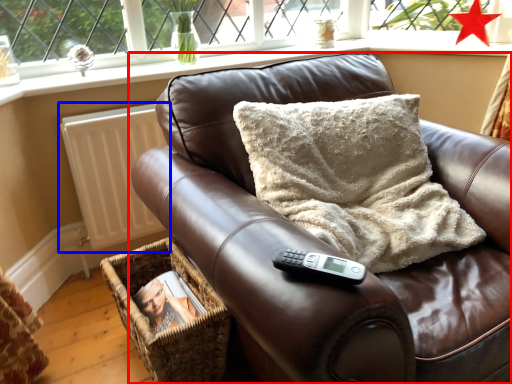
Question: Among these objects, which one is nearest to the camera, furniture (highlighted by a red box) or radiator (highlighted by a blue box)?

Choices:
 (A) furniture
 (B) radiator

Answer: (A)